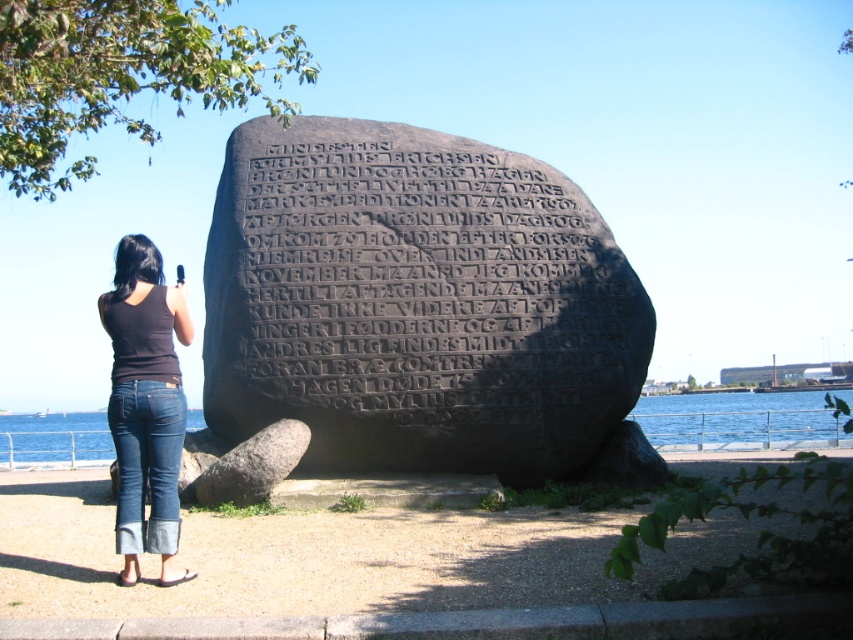
Question: In this image, where is black stone engraving at center located relative to black stone boulder at lower center?

Choices:
 (A) below
 (B) above

Answer: (B)

Question: Is denim jeans at lower left below blue water at lower center?

Choices:
 (A) no
 (B) yes

Answer: (A)

Question: Can you confirm if denim jeans at lower left is bigger than black stone boulder at lower center?

Choices:
 (A) yes
 (B) no

Answer: (A)

Question: Which object is positioned closest to the black stone engraving at center?

Choices:
 (A) denim jeans at lower left
 (B) blue water at lower center

Answer: (A)

Question: Which object is closer to the camera taking this photo?

Choices:
 (A) denim jeans at lower left
 (B) black stone boulder at lower center
 (C) black stone engraving at center
 (D) blue water at lower center

Answer: (A)

Question: Which of the following is the farthest from the observer?

Choices:
 (A) blue water at lower center
 (B) denim jeans at lower left
 (C) black stone boulder at lower center

Answer: (A)